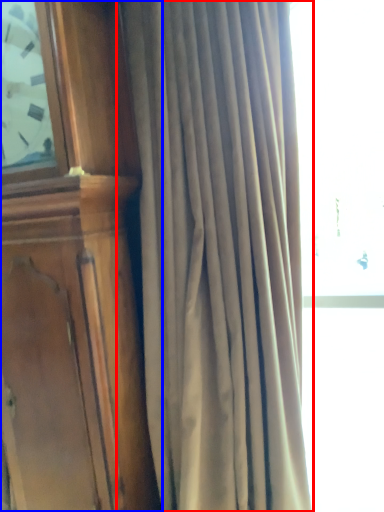
Question: Which point is closer to the camera, curtain (highlighted by a red box) or furniture (highlighted by a blue box)?

Choices:
 (A) curtain
 (B) furniture

Answer: (A)